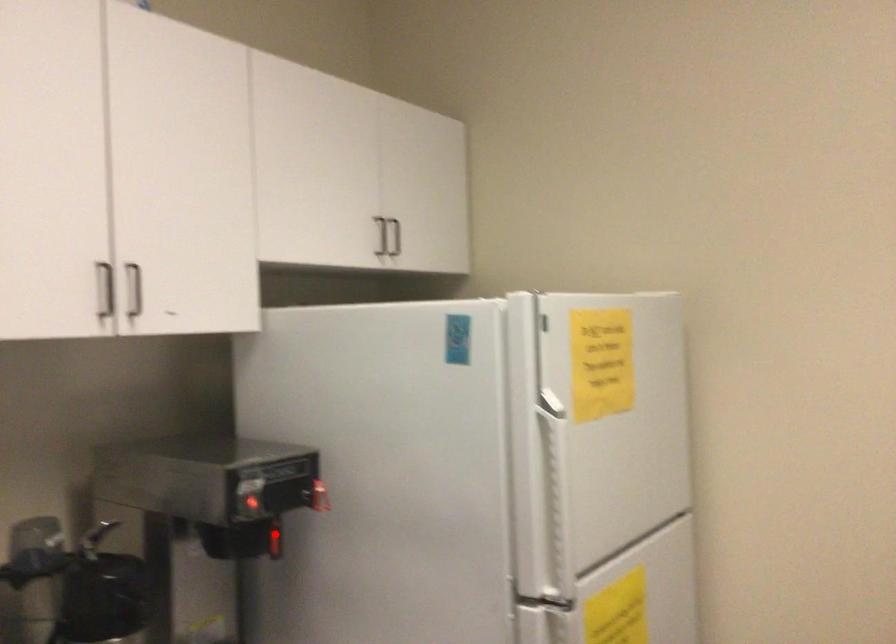
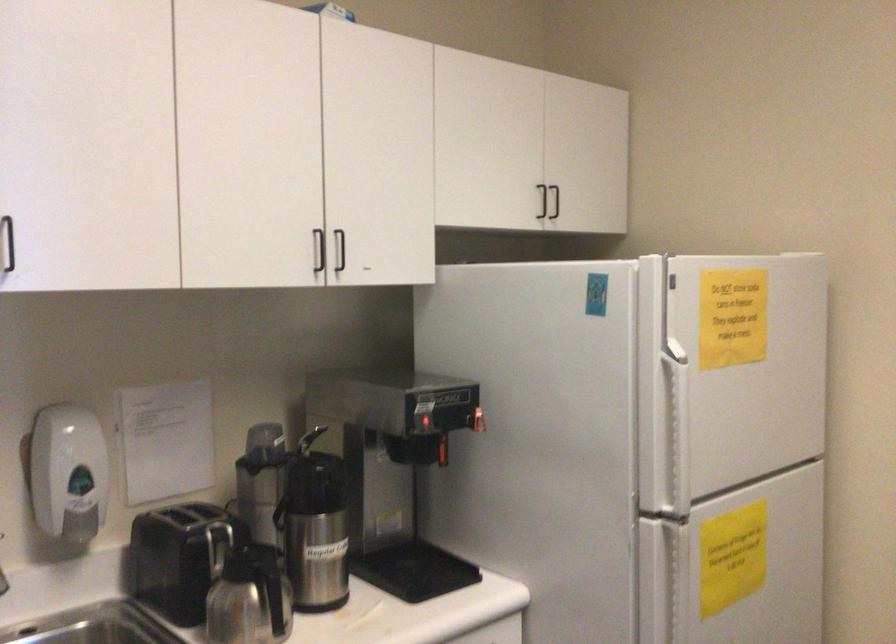
Question: I am providing you with two images of the same scene from different viewpoints. Given a red point in image1, look at the same physical point in image2. Is it:

Choices:
 (A) Closer to the viewpoint
 (B) Farther from the viewpoint

Answer: (B)